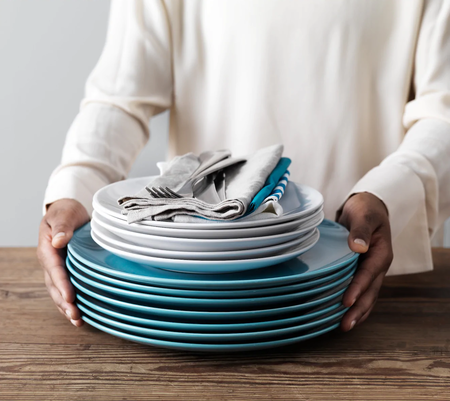
Locate an element on the screen. The width and height of the screenshot is (450, 401). white plates is located at coordinates (212, 224), (214, 231), (216, 242), (218, 253), (222, 265).